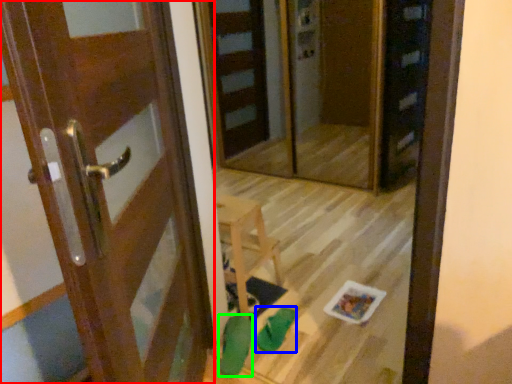
Question: Which object is the farthest from door (highlighted by a red box)? Choose among these: shoe (highlighted by a blue box) or shoe (highlighted by a green box).

Choices:
 (A) shoe
 (B) shoe

Answer: (A)